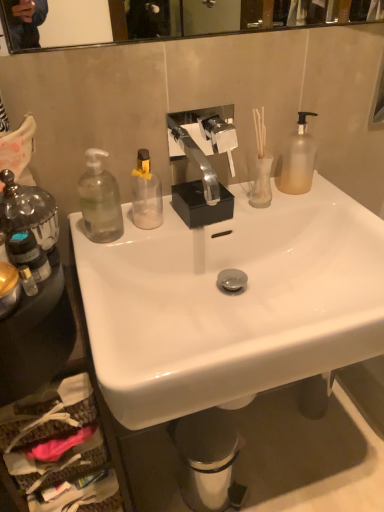
Question: Would you consider translucent plastic bottle at left, which is counted as the 4th bottle, starting from the right, to be distant from clear glass bottle at left, which is counted as the fifth bottle, starting from the right?

Choices:
 (A) no
 (B) yes

Answer: (A)

Question: Does translucent plastic bottle at left, which is counted as the 4th bottle, starting from the right, have a lesser height compared to clear glass bottle at left, the 1th bottle when ordered from left to right?

Choices:
 (A) yes
 (B) no

Answer: (A)

Question: From the image's perspective, is translucent plastic bottle at left, which is counted as the 4th bottle, starting from the right, under clear glass bottle at left, the 1th bottle when ordered from left to right?

Choices:
 (A) yes
 (B) no

Answer: (A)

Question: Considering the relative positions of translucent plastic bottle at left, which ranks as the 2th bottle in left-to-right order, and clear glass bottle at left, which is counted as the fifth bottle, starting from the right, in the image provided, is translucent plastic bottle at left, which ranks as the 2th bottle in left-to-right order, to the right of clear glass bottle at left, which is counted as the fifth bottle, starting from the right, from the viewer's perspective?

Choices:
 (A) no
 (B) yes

Answer: (B)

Question: Considering the relative sizes of translucent plastic bottle at left, which ranks as the 2th bottle in left-to-right order, and clear glass bottle at left, the 1th bottle when ordered from left to right, in the image provided, is translucent plastic bottle at left, which ranks as the 2th bottle in left-to-right order, wider than clear glass bottle at left, the 1th bottle when ordered from left to right,?

Choices:
 (A) no
 (B) yes

Answer: (A)

Question: Considering the positions of point (19, 270) and point (102, 178), is point (19, 270) closer or farther from the camera than point (102, 178)?

Choices:
 (A) closer
 (B) farther

Answer: (A)

Question: Considering their positions, is translucent glass bottle at left, placed as the 3th bottle when sorted from right to left, located in front of or behind transparent glass soap dispenser at left, acting as the fourth bottle starting from the left?

Choices:
 (A) behind
 (B) front

Answer: (B)

Question: In terms of width, does translucent glass bottle at left, placed as the 3th bottle when sorted from right to left, look wider or thinner when compared to transparent glass soap dispenser at left, which is the 2th bottle from right to left?

Choices:
 (A) thin
 (B) wide

Answer: (A)

Question: Based on their positions, is translucent glass bottle at left, placed as the 3th bottle when sorted from right to left, located to the left or right of transparent glass soap dispenser at left, which is the 2th bottle from right to left?

Choices:
 (A) left
 (B) right

Answer: (A)

Question: In terms of height, does translucent plastic bottle at left, which is counted as the 4th bottle, starting from the right, look taller or shorter compared to metallic silver trash can at lower center?

Choices:
 (A) tall
 (B) short

Answer: (B)

Question: Is translucent plastic bottle at left, which is counted as the 4th bottle, starting from the right, wider or thinner than metallic silver trash can at lower center?

Choices:
 (A) thin
 (B) wide

Answer: (A)

Question: Visually, is translucent plastic bottle at left, which ranks as the 2th bottle in left-to-right order, positioned to the left or to the right of metallic silver trash can at lower center?

Choices:
 (A) right
 (B) left

Answer: (B)

Question: Is point (x=29, y=245) closer or farther from the camera than point (x=208, y=472)?

Choices:
 (A) closer
 (B) farther

Answer: (A)

Question: Visually, is translucent plastic bottle at left, which is counted as the 4th bottle, starting from the right, positioned to the left or to the right of transparent glass soap dispenser at left, acting as the fourth bottle starting from the left?

Choices:
 (A) right
 (B) left

Answer: (B)

Question: From the image's perspective, relative to transparent glass soap dispenser at left, which is the 2th bottle from right to left, is translucent plastic bottle at left, which ranks as the 2th bottle in left-to-right order, above or below?

Choices:
 (A) above
 (B) below

Answer: (B)